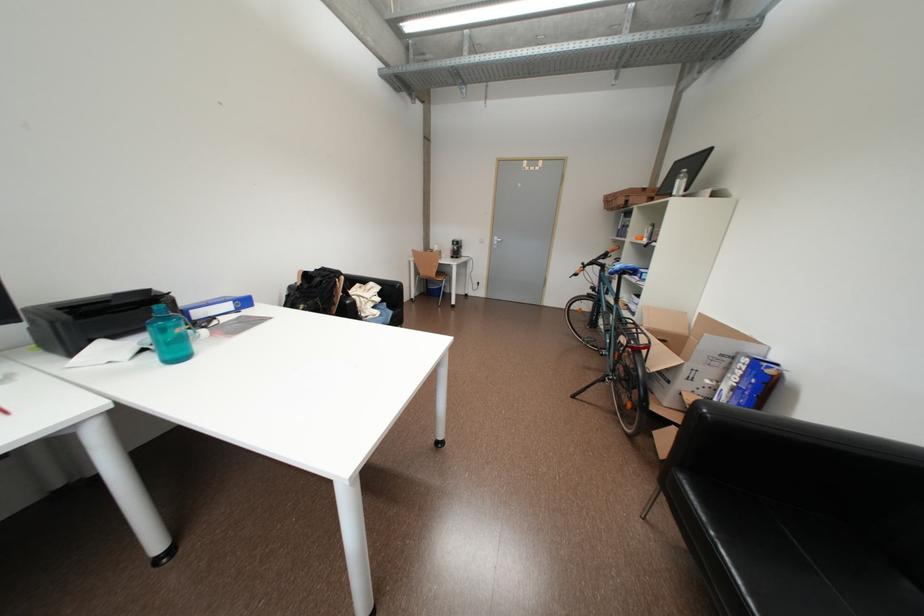
Where is `grey door handle`? grey door handle is located at coordinates (495, 241).